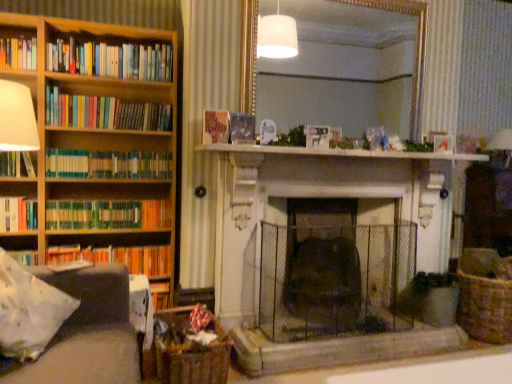
Where is `multicolored paperbacks at left, the 7th book ordered from the bottom`? The image size is (512, 384). multicolored paperbacks at left, the 7th book ordered from the bottom is located at coordinates (104, 112).

What do you see at coordinates (216, 126) in the screenshot? This screenshot has height=384, width=512. I see `wooden book at center, acting as the 3th book starting from the top` at bounding box center [216, 126].

What do you see at coordinates (117, 257) in the screenshot? I see `hardcover book at left, the 8th book in the top-to-bottom sequence` at bounding box center [117, 257].

At what (x,y) coordinates should I click in order to perform the action: click on gold-framed mirror at upper center. Please return your answer as a coordinate pair (x, y). This screenshot has width=512, height=384. Looking at the image, I should click on (340, 66).

In the scene shown: Is dark gray fabric armchair at left shorter than hardcover book at left, the 8th book in the top-to-bottom sequence?

No.

From a real-world perspective, who is located lower, dark gray fabric armchair at left or hardcover book at left, the 8th book in the top-to-bottom sequence?

dark gray fabric armchair at left, from a real-world perspective.

Does dark gray fabric armchair at left turn towards hardcover book at left, the first book when ordered from bottom to top?

No, dark gray fabric armchair at left is not facing towards hardcover book at left, the first book when ordered from bottom to top.

Is dark gray fabric armchair at left smaller than hardcover book at left, the first book when ordered from bottom to top?

No, dark gray fabric armchair at left is not smaller than hardcover book at left, the first book when ordered from bottom to top.

At what (x,y) coordinates should I click in order to perform the action: click on mirror above the hardcover book at left, the 8th book in the top-to-bottom sequence (from the image's perspective). Please return your answer as a coordinate pair (x, y). The height and width of the screenshot is (384, 512). Looking at the image, I should click on (340, 66).

In the scene shown: From the image's perspective, which one is positioned lower, hardcover book at left, the 8th book in the top-to-bottom sequence, or gold-framed mirror at upper center?

hardcover book at left, the 8th book in the top-to-bottom sequence, appears lower in the image.

Considering the positions of objects hardcover book at left, the 8th book in the top-to-bottom sequence, and gold-framed mirror at upper center in the image provided, who is in front, hardcover book at left, the 8th book in the top-to-bottom sequence, or gold-framed mirror at upper center?

hardcover book at left, the 8th book in the top-to-bottom sequence, is closer to the camera.

Is hardcover book at left, the first book when ordered from bottom to top, to the left of gold-framed mirror at upper center from the viewer's perspective?

Yes, hardcover book at left, the first book when ordered from bottom to top, is to the left of gold-framed mirror at upper center.

Is gold-framed mirror at upper center touching white marble fireplace at center?

No, gold-framed mirror at upper center is not with white marble fireplace at center.

Considering the relative positions of gold-framed mirror at upper center and white marble fireplace at center in the image provided, is gold-framed mirror at upper center to the left or to the right of white marble fireplace at center?

Clearly, gold-framed mirror at upper center is on the left of white marble fireplace at center in the image.

Between gold-framed mirror at upper center and white marble fireplace at center, which one has larger width?

white marble fireplace at center is wider.

Is gold-framed mirror at upper center surrounding white marble fireplace at center?

No, white marble fireplace at center is not inside gold-framed mirror at upper center.

Considering the sizes of objects white marble fireplace at center and wooden book at center, the 6th book in the bottom-to-top sequence, in the image provided, who is smaller, white marble fireplace at center or wooden book at center, the 6th book in the bottom-to-top sequence,?

With smaller size is wooden book at center, the 6th book in the bottom-to-top sequence.

Which point is more distant from viewer, [460,153] or [224,134]?

Point [460,153]

Is wooden book at center, the 6th book in the bottom-to-top sequence, surrounded by white marble fireplace at center?

That's incorrect, wooden book at center, the 6th book in the bottom-to-top sequence, is not inside white marble fireplace at center.

Does green matte bookshelf at left, which is counted as the 2th book, starting from the bottom, have a lesser width compared to woven brown basket at lower left, positioned as the 1th basket in front-to-back order?

Yes.

Can you confirm if green matte bookshelf at left, which is counted as the 2th book, starting from the bottom, is bigger than woven brown basket at lower left, which is counted as the second basket, starting from the back?

Actually, green matte bookshelf at left, which is counted as the 2th book, starting from the bottom, might be smaller than woven brown basket at lower left, which is counted as the second basket, starting from the back.

The height and width of the screenshot is (384, 512). I want to click on the 2nd book positioned above the woven brown basket at lower left, which is counted as the second basket, starting from the back (from a real-world perspective), so click(x=106, y=214).

Is green matte bookshelf at left, which is counted as the 2th book, starting from the bottom, facing towards woven brown basket at lower left, the 2th basket viewed from the right?

No.

Does hardcover book at left, arranged as the 5th book when ordered from the bottom, have a smaller size compared to woven brown basket at lower right, acting as the 1th basket starting from the right?

Yes, hardcover book at left, arranged as the 5th book when ordered from the bottom, is smaller than woven brown basket at lower right, acting as the 1th basket starting from the right.

Based on the photo, from the image's perspective, between hardcover book at left, positioned as the 4th book in top-to-bottom order, and woven brown basket at lower right, which is the 2th basket from left to right, which one is located above?

hardcover book at left, positioned as the 4th book in top-to-bottom order, appears higher in the image.

From a real-world perspective, is hardcover book at left, positioned as the 4th book in top-to-bottom order, physically located above or below woven brown basket at lower right, which is the 2th basket from front to back?

In terms of real-world spatial position, hardcover book at left, positioned as the 4th book in top-to-bottom order, is above woven brown basket at lower right, which is the 2th basket from front to back.

From a real-world perspective, relative to woven brown basket at lower right, acting as the 1th basket starting from the right, is wooden bookshelf at left vertically above or below?

In terms of real-world spatial position, wooden bookshelf at left is above woven brown basket at lower right, acting as the 1th basket starting from the right.

Considering the positions of point (54, 147) and point (508, 310), is point (54, 147) closer or farther from the camera than point (508, 310)?

Point (54, 147) is closer to the camera than point (508, 310).

Is wooden bookshelf at left oriented towards woven brown basket at lower right, acting as the 1th basket starting from the right?

No, wooden bookshelf at left does not turn towards woven brown basket at lower right, acting as the 1th basket starting from the right.

Choose the correct answer: Is wooden bookshelf at left inside woven brown basket at lower right, which is the 2th basket from front to back, or outside it?

wooden bookshelf at left is located beyond the bounds of woven brown basket at lower right, which is the 2th basket from front to back.

Image resolution: width=512 pixels, height=384 pixels. What are the coordinates of `the 5th book to the left of the dark gray fabric armchair at left, starting your count from the anchor` in the screenshot? It's located at (117, 257).

Locate an element on the screen. The image size is (512, 384). mirror on the right side of hardcover book at left, the 8th book in the top-to-bottom sequence is located at coordinates (340, 66).

Which object lies further to the anchor point wooden bookshelf at left, hardcover books at left, the 1th book positioned from the top, or wooden book at center, the 6th book in the bottom-to-top sequence?

Based on the image, wooden book at center, the 6th book in the bottom-to-top sequence, appears to be further to wooden bookshelf at left.

Which object lies further to the anchor point green matte bookshelf at left, placed as the fifth book when sorted from top to bottom, wooden book at center, the 6th book in the bottom-to-top sequence, or hardcover books at left, the 8th book ordered from the bottom?

wooden book at center, the 6th book in the bottom-to-top sequence, is further to green matte bookshelf at left, placed as the fifth book when sorted from top to bottom.

Considering their positions, is woven brown basket at lower left, the 2th basket viewed from the right, positioned further to dark gray fabric armchair at left than multicolored paperbacks at left, which ranks as the second book in top-to-bottom order?

multicolored paperbacks at left, which ranks as the second book in top-to-bottom order, lies further to dark gray fabric armchair at left than the other object.

Estimate the real-world distances between objects in this image. Which object is further from white marble fireplace at center, hardcover book at left, arranged as the 5th book when ordered from the bottom, or white fabric pillow at lower left?

hardcover book at left, arranged as the 5th book when ordered from the bottom, is further to white marble fireplace at center.

Estimate the real-world distances between objects in this image. Which object is further from multicolored paperbacks at left, the 7th book ordered from the bottom, hardcover book at left, the 8th book in the top-to-bottom sequence, or white marble fireplace at center?

hardcover book at left, the 8th book in the top-to-bottom sequence.

Based on the photo, considering their positions, is gold-framed mirror at upper center positioned further to woven brown basket at lower left, which is counted as the first basket, starting from the left, than hardcover book at left, the 8th book in the top-to-bottom sequence?

The object further to woven brown basket at lower left, which is counted as the first basket, starting from the left, is gold-framed mirror at upper center.

When comparing their distances from hardcover books at left, the 8th book ordered from the bottom, does woven brown basket at lower right, marked as the first basket in a back-to-front arrangement, or wooden bookshelf at left seem further?

The object further to hardcover books at left, the 8th book ordered from the bottom, is woven brown basket at lower right, marked as the first basket in a back-to-front arrangement.

Which object lies further to the anchor point hardcover book at left, the 6th book when ordered from top to bottom, hardcover book at left, arranged as the 5th book when ordered from the bottom, or green matte bookshelf at left, the seventh book viewed from the top?

green matte bookshelf at left, the seventh book viewed from the top, is further to hardcover book at left, the 6th book when ordered from top to bottom.

Locate an element on the screen. bookcase between dark gray fabric armchair at left and wooden book at center, acting as the 3th book starting from the top, in the front-back direction is located at coordinates (98, 144).

You are a GUI agent. You are given a task and a screenshot of the screen. Output one action in this format:
    pyautogui.click(x=<x>, y=<y>)
    Task: Click on the bookcase between hardcover book at left, arranged as the 5th book when ordered from the bottom, and hardcover book at left, the 8th book in the top-to-bottom sequence, from top to bottom
    This screenshot has height=384, width=512.
    Given the screenshot: What is the action you would take?
    pyautogui.click(x=98, y=144)

Identify the location of pillow between dark gray fabric armchair at left and gold-framed mirror at upper center in the front-back direction. (29, 310).

This screenshot has width=512, height=384. I want to click on shelf positioned between dark gray fabric armchair at left and wooden bookshelf at left from near to far, so click(17, 118).